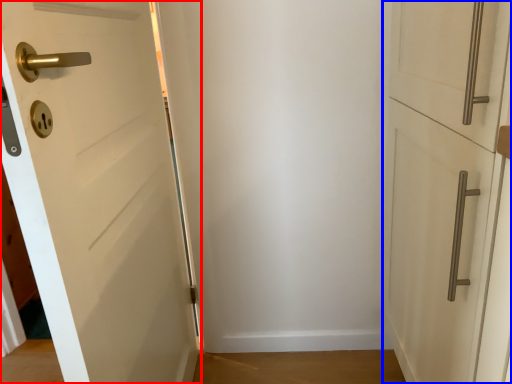
Question: Which object appears farthest to the camera in this image, door (highlighted by a red box) or door (highlighted by a blue box)?

Choices:
 (A) door
 (B) door

Answer: (B)